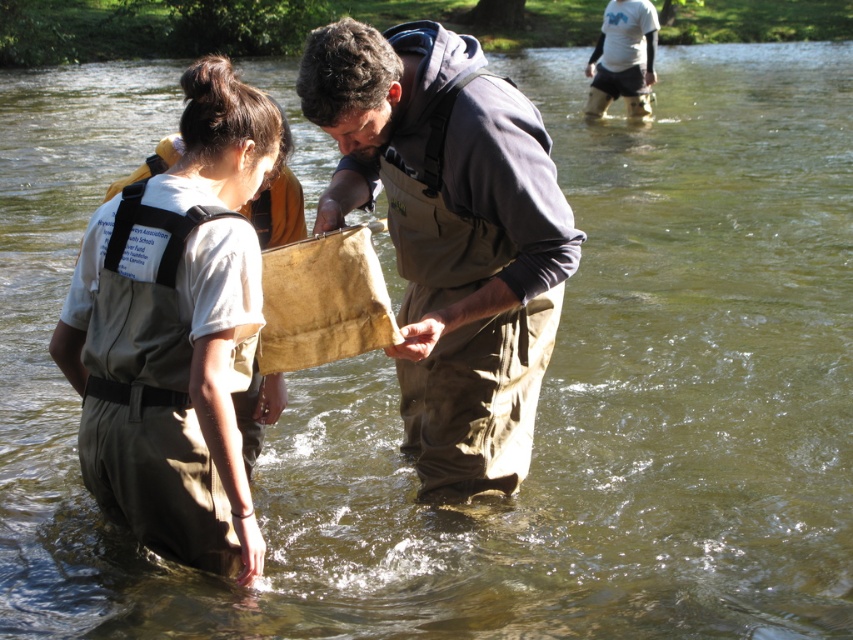
Can you confirm if brown canvas bag at center is shorter than khaki fabric waders at left?

Incorrect, brown canvas bag at center's height does not fall short of khaki fabric waders at left's.

Locate an element on the screen. brown canvas bag at center is located at coordinates (450, 236).

Find the location of a particular element. brown canvas bag at center is located at coordinates (450, 236).

Who is positioned more to the left, khaki fabric waders at left or white t-shirt at upper center?

Positioned to the left is khaki fabric waders at left.

Describe the element at coordinates (177, 330) in the screenshot. I see `khaki fabric waders at left` at that location.

Describe the element at coordinates (177, 330) in the screenshot. I see `khaki fabric waders at left` at that location.

I want to click on khaki fabric waders at left, so click(x=177, y=330).

In the scene shown: Between brown canvas bag at center and white t-shirt at upper center, which one is positioned lower?

brown canvas bag at center is below.

Which is in front, point (320, 70) or point (635, 19)?

Positioned in front is point (320, 70).

This screenshot has height=640, width=853. In order to click on brown canvas bag at center in this screenshot , I will do `click(450, 236)`.